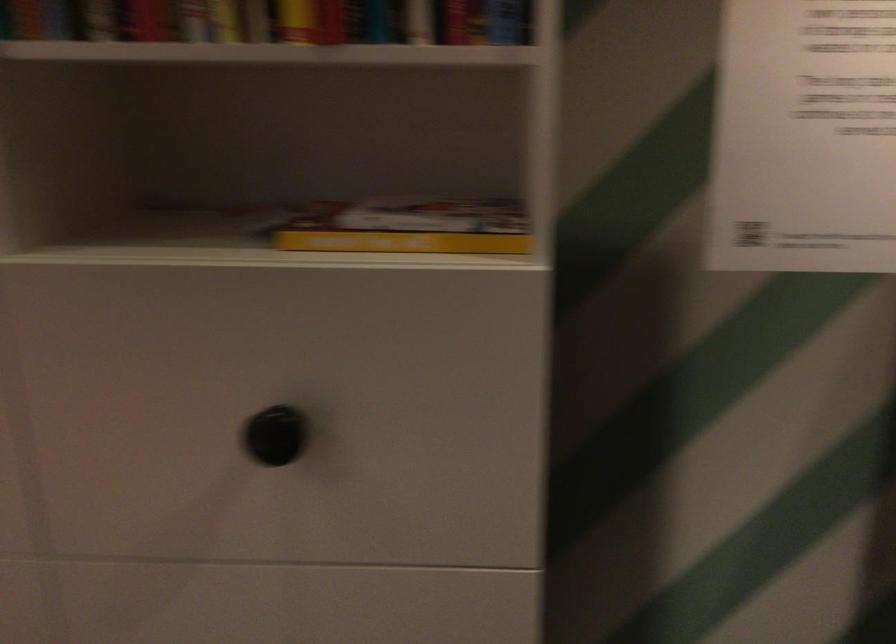
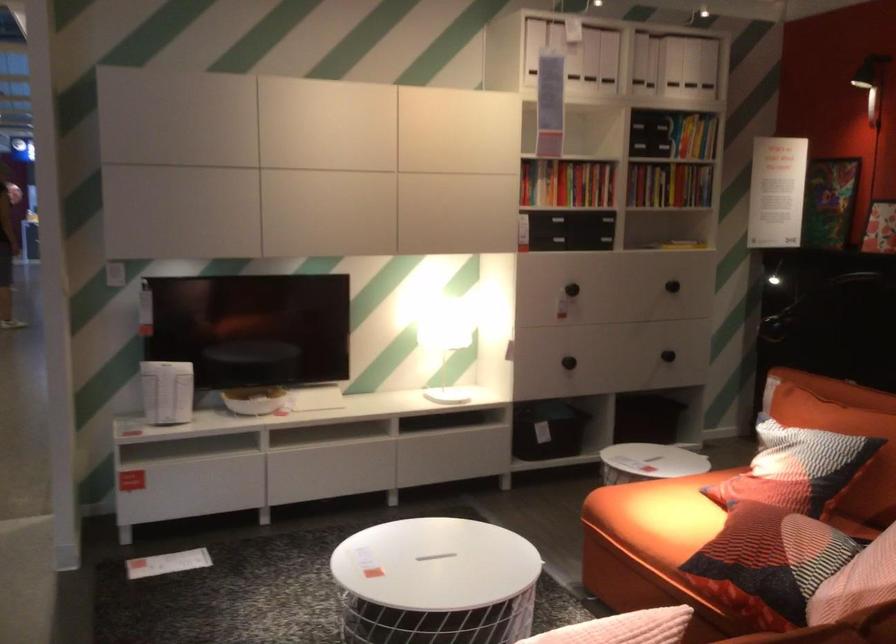
In a continuous first-person perspective shot, in which direction is the camera moving?

The movement direction of the cameraman is left, backward.